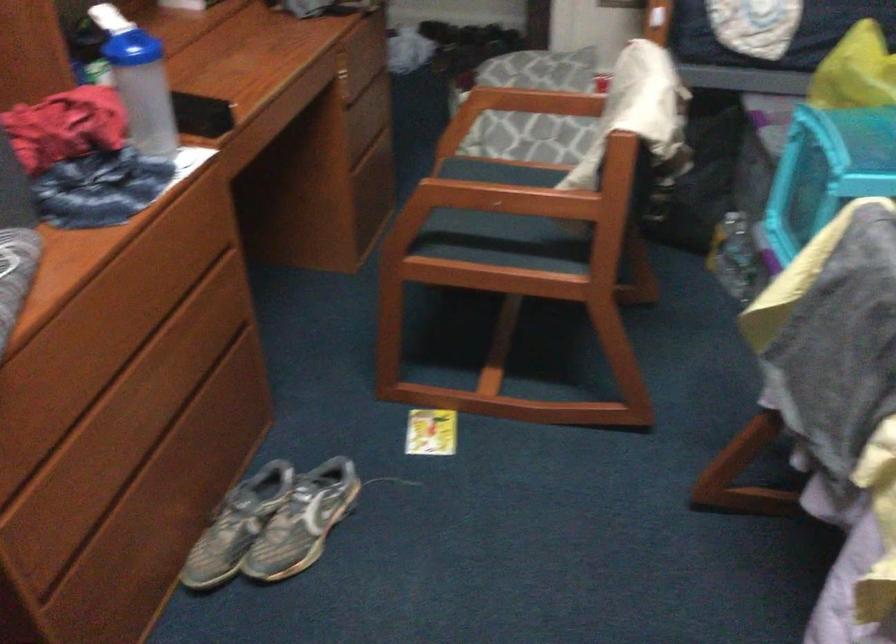
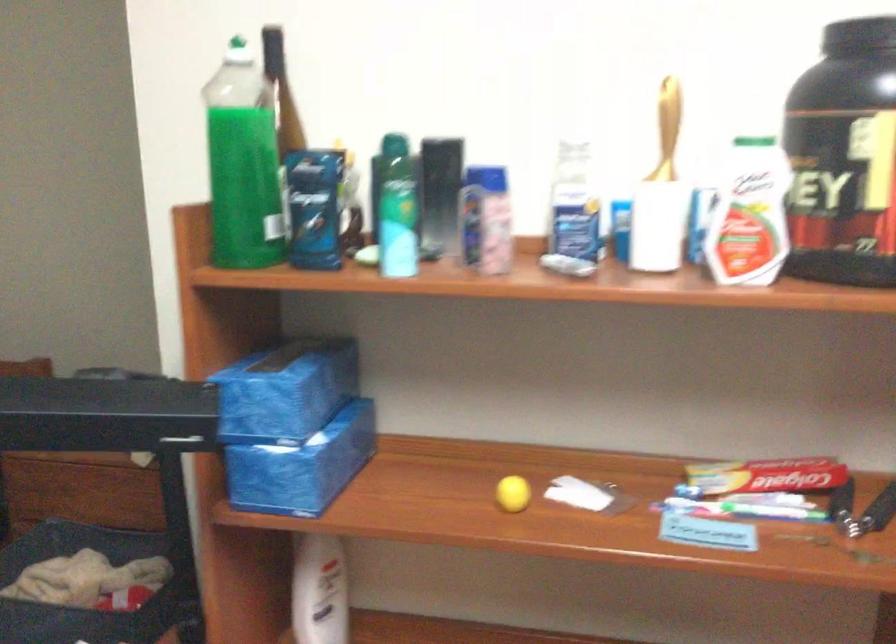
Question: The camera is either moving clockwise (left) or counter-clockwise (right) around the object. The first image is from the beginning of the video and the second image is from the end. Is the camera moving left or right when shooting the video?

Choices:
 (A) Left
 (B) Right

Answer: (A)